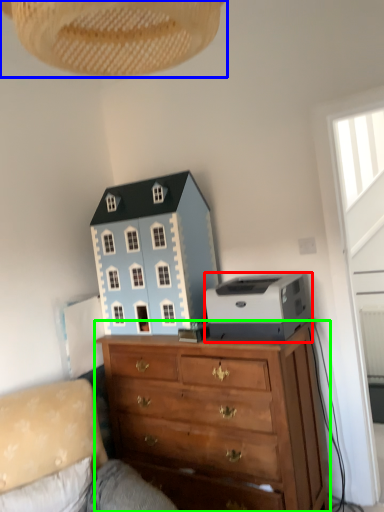
Question: Which object is positioned farthest from printer (highlighted by a red box)? Select from lamp (highlighted by a blue box) and chest of drawers (highlighted by a green box).

Choices:
 (A) lamp
 (B) chest of drawers

Answer: (A)